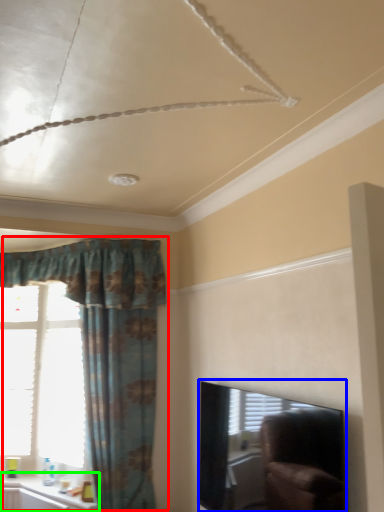
Question: Which object is positioned closest to curtain (highlighted by a red box)? Select from window screen (highlighted by a blue box) and window sill (highlighted by a green box).

Choices:
 (A) window screen
 (B) window sill

Answer: (B)